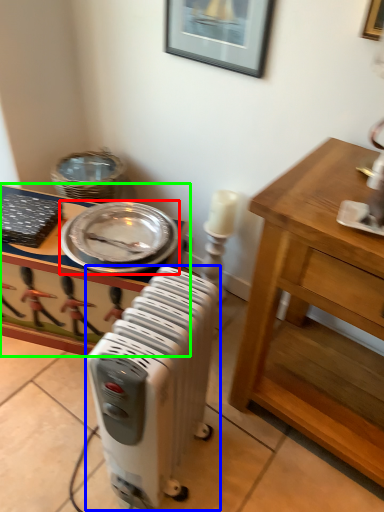
Question: Based on their relative distances, which object is nearer to platter (highlighted by a red box)? Choose from home appliance (highlighted by a blue box) and desk (highlighted by a green box).

Choices:
 (A) home appliance
 (B) desk

Answer: (B)